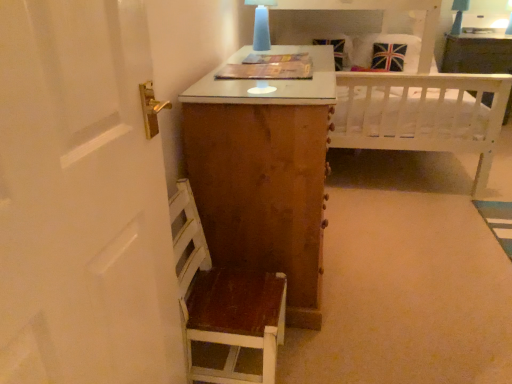
The height and width of the screenshot is (384, 512). What do you see at coordinates (477, 54) in the screenshot? I see `white wood vanity at upper right` at bounding box center [477, 54].

Image resolution: width=512 pixels, height=384 pixels. I want to click on matte blue glass at upper center, so click(261, 24).

I want to click on wooden chair at lower left, so click(224, 302).

Is white wooden bed at upper center not near matte blue glass at upper center?

They are positioned close to each other.

Between white wooden bed at upper center and matte blue glass at upper center, which one has larger size?

white wooden bed at upper center.

Looking at their sizes, would you say white wooden bed at upper center is wider or thinner than matte blue glass at upper center?

Considering their sizes, white wooden bed at upper center looks broader than matte blue glass at upper center.

From a real-world perspective, is white wooden bed at upper center physically located above or below matte blue glass at upper center?

white wooden bed at upper center is below matte blue glass at upper center.

Considering the sizes of objects matte blue glass at upper center and union jack fabric pillow at upper right in the image provided, who is smaller, matte blue glass at upper center or union jack fabric pillow at upper right?

With smaller size is matte blue glass at upper center.

Is matte blue glass at upper center turned away from union jack fabric pillow at upper right?

→ No, matte blue glass at upper center is not facing the opposite direction of union jack fabric pillow at upper right.

Choose the correct answer: Is matte blue glass at upper center inside union jack fabric pillow at upper right or outside it?

matte blue glass at upper center cannot be found inside union jack fabric pillow at upper right.

From a real-world perspective, between matte blue glass at upper center and union jack fabric pillow at upper right, who is vertically higher?

matte blue glass at upper center is physically above.

Is union jack fabric pillow at upper right turned away from white wooden bed at upper center?

Yes.

In the scene shown: Which of these two, union jack fabric pillow at upper right or white wooden bed at upper center, is thinner?

With smaller width is union jack fabric pillow at upper right.

You are a GUI agent. You are given a task and a screenshot of the screen. Output one action in this format:
    pyautogui.click(x=<x>, y=<y>)
    Task: Click on the bed below the union jack fabric pillow at upper right (from a real-world perspective)
    
    Given the screenshot: What is the action you would take?
    pyautogui.click(x=402, y=87)

Can white wooden bed at upper center be found inside union jack fabric pillow at upper right?

No, white wooden bed at upper center is not surrounded by union jack fabric pillow at upper right.

Can you see white wooden bed at upper center touching wooden chair at lower left?

No, white wooden bed at upper center is not with wooden chair at lower left.

From a real-world perspective, between white wooden bed at upper center and wooden chair at lower left, who is vertically higher?

white wooden bed at upper center, from a real-world perspective.

In the image, is white wooden bed at upper center positioned in front of or behind wooden chair at lower left?

In the image, white wooden bed at upper center appears behind wooden chair at lower left.

In the image, there is a wooden chair at lower left. Where is `pillow above it (from the image's perspective)`? pillow above it (from the image's perspective) is located at coordinates (388, 51).

From the image's perspective, is union jack fabric pillow at upper right located above or below wooden chair at lower left?

union jack fabric pillow at upper right is above wooden chair at lower left.

Is union jack fabric pillow at upper right oriented away from wooden chair at lower left?

union jack fabric pillow at upper right does not have its back to wooden chair at lower left.

In the scene shown: Which of these two, union jack fabric pillow at upper right or wooden chair at lower left, is thinner?

wooden chair at lower left.

Is matte blue glass at upper center positioned with its back to wooden chair at lower left?

That's not correct — matte blue glass at upper center is not looking away from wooden chair at lower left.

Is matte blue glass at upper center directly adjacent to wooden chair at lower left?

No, matte blue glass at upper center is not making contact with wooden chair at lower left.

Does matte blue glass at upper center have a greater height compared to wooden chair at lower left?

No.

In the image, there is a matte blue glass at upper center. Identify the location of vanity below it (from a real-world perspective). The height and width of the screenshot is (384, 512). (477, 54).

Is matte blue glass at upper center taller or shorter than white wood vanity at upper right?

Considering their sizes, matte blue glass at upper center has less height than white wood vanity at upper right.

Based on the photo, would you say matte blue glass at upper center is a long distance from white wood vanity at upper right?

Yes, matte blue glass at upper center is far from white wood vanity at upper right.

Is matte blue glass at upper center looking in the opposite direction of white wood vanity at upper right?

No.

Locate an element on the screen. The height and width of the screenshot is (384, 512). table lamp above the white wooden bed at upper center (from a real-world perspective) is located at coordinates (261, 24).

You are a GUI agent. You are given a task and a screenshot of the screen. Output one action in this format:
    pyautogui.click(x=<x>, y=<y>)
    Task: Click on the pillow that is on the right side of matte blue glass at upper center
    
    Given the screenshot: What is the action you would take?
    pyautogui.click(x=388, y=51)

Considering their positions, is white wood vanity at upper right positioned closer to matte blue glass at upper center than wooden chair at lower left?

Based on the image, wooden chair at lower left appears to be nearer to matte blue glass at upper center.

Based on their spatial positions, is white wooden bed at upper center or union jack fabric pillow at upper right closer to matte blue glass at upper center?

The object closer to matte blue glass at upper center is white wooden bed at upper center.

When comparing their distances from white wood vanity at upper right, does white wooden bed at upper center or wooden chair at lower left seem closer?

white wooden bed at upper center.

Which object lies further to the anchor point white wooden bed at upper center, white wood vanity at upper right or matte blue glass at upper center?

white wood vanity at upper right.

Which object lies further to the anchor point matte blue glass at upper center, union jack fabric pillow at upper right or white wooden bed at upper center?

union jack fabric pillow at upper right lies further to matte blue glass at upper center than the other object.

Based on their spatial positions, is white wooden bed at upper center or union jack fabric pillow at upper right closer to wooden chair at lower left?

Based on the image, white wooden bed at upper center appears to be nearer to wooden chair at lower left.

Based on their spatial positions, is matte blue glass at upper center or white wood vanity at upper right closer to wooden chair at lower left?

Among the two, matte blue glass at upper center is located nearer to wooden chair at lower left.

Based on their spatial positions, is wooden chair at lower left or matte blue glass at upper center further from white wooden bed at upper center?

Among the two, wooden chair at lower left is located further to white wooden bed at upper center.

Where is `table lamp between white wooden bed at upper center and wooden chair at lower left in the vertical direction`? table lamp between white wooden bed at upper center and wooden chair at lower left in the vertical direction is located at coordinates (261, 24).

The image size is (512, 384). Find the location of `pillow between matte blue glass at upper center and white wood vanity at upper right from left to right`. pillow between matte blue glass at upper center and white wood vanity at upper right from left to right is located at coordinates (388, 51).

Identify the location of bed between wooden chair at lower left and union jack fabric pillow at upper right in the front-back direction. This screenshot has width=512, height=384. (402, 87).

You are a GUI agent. You are given a task and a screenshot of the screen. Output one action in this format:
    pyautogui.click(x=<x>, y=<y>)
    Task: Click on the bed between matte blue glass at upper center and union jack fabric pillow at upper right along the z-axis
    The width and height of the screenshot is (512, 384).
    Given the screenshot: What is the action you would take?
    pyautogui.click(x=402, y=87)